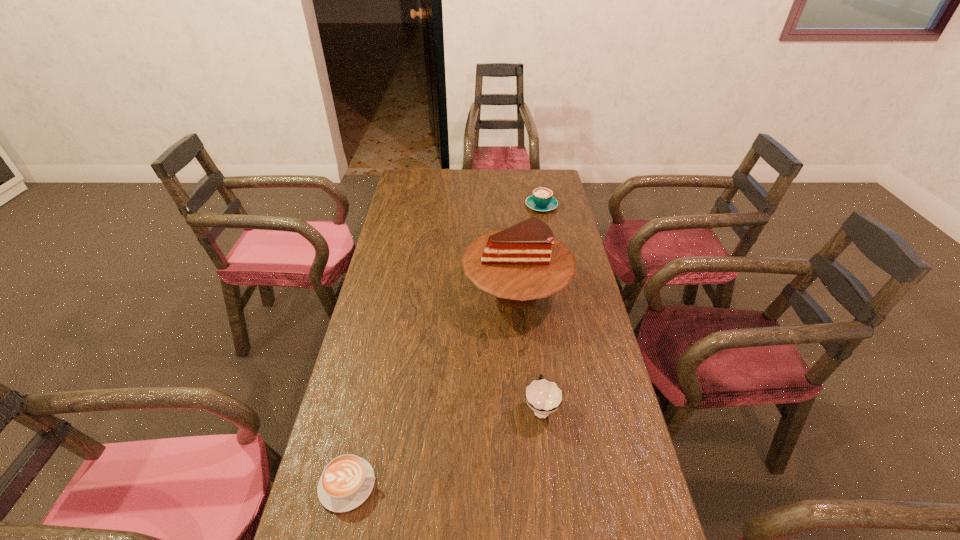
Where is `blank space at the left edge of the desktop`? The image size is (960, 540). blank space at the left edge of the desktop is located at coordinates (397, 215).

The height and width of the screenshot is (540, 960). I want to click on free space at the right edge of the desktop, so click(x=579, y=297).

Locate an element on the screen. This screenshot has height=540, width=960. vacant region at the far left corner of the desktop is located at coordinates (398, 188).

Identify the location of vacant position at the far right corner of the desktop. This screenshot has width=960, height=540. point(527,179).

Locate an element on the screen. This screenshot has height=540, width=960. blank region between the shortest object and the third tallest object is located at coordinates (444, 345).

At what (x,y) coordinates should I click in order to perform the action: click on free space between the shorter cappuccino and the second shortest object. Please return your answer as a coordinate pair (x, y). The width and height of the screenshot is (960, 540). Looking at the image, I should click on (444, 345).

The image size is (960, 540). What are the coordinates of `free spot between the second farthest object and the nearer cappuccino` in the screenshot? It's located at coord(432,388).

Where is `free space between the tallest object and the third shortest object`? free space between the tallest object and the third shortest object is located at coordinates (529, 350).

In order to click on vacant area that lies between the right cappuccino and the cup in this screenshot , I will do `click(541, 307)`.

Where is `empty space between the right cappuccino and the third shortest object`? This screenshot has height=540, width=960. empty space between the right cappuccino and the third shortest object is located at coordinates (541, 307).